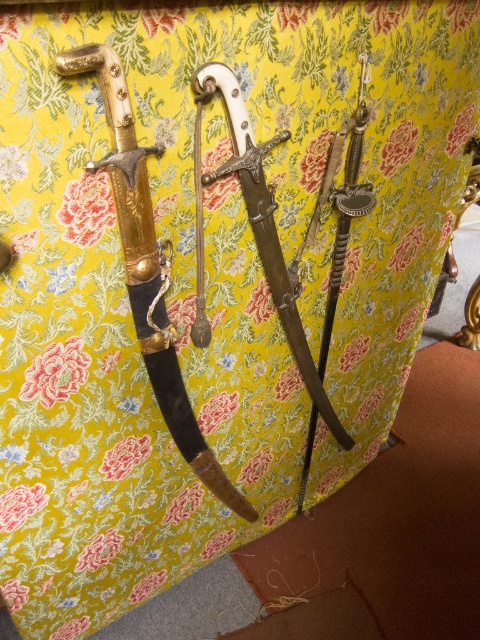
Question: Is gold plated dagger at left below polished silver dagger at center?

Choices:
 (A) yes
 (B) no

Answer: (A)

Question: Among these points, which one is nearest to the camera?

Choices:
 (A) (331, 152)
 (B) (134, 209)
 (C) (218, 170)

Answer: (B)

Question: Does gold plated dagger at left have a greater width compared to polished silver sword at center?

Choices:
 (A) yes
 (B) no

Answer: (A)

Question: Which point is closer to the camera taking this photo?

Choices:
 (A) (327, 195)
 (B) (312, 401)
 (C) (140, 246)

Answer: (C)

Question: Does polished silver dagger at center appear under polished silver sword at center?

Choices:
 (A) no
 (B) yes

Answer: (A)

Question: Which point appears closest to the camera in this image?

Choices:
 (A) (279, 300)
 (B) (154, 259)
 (C) (338, 188)

Answer: (B)